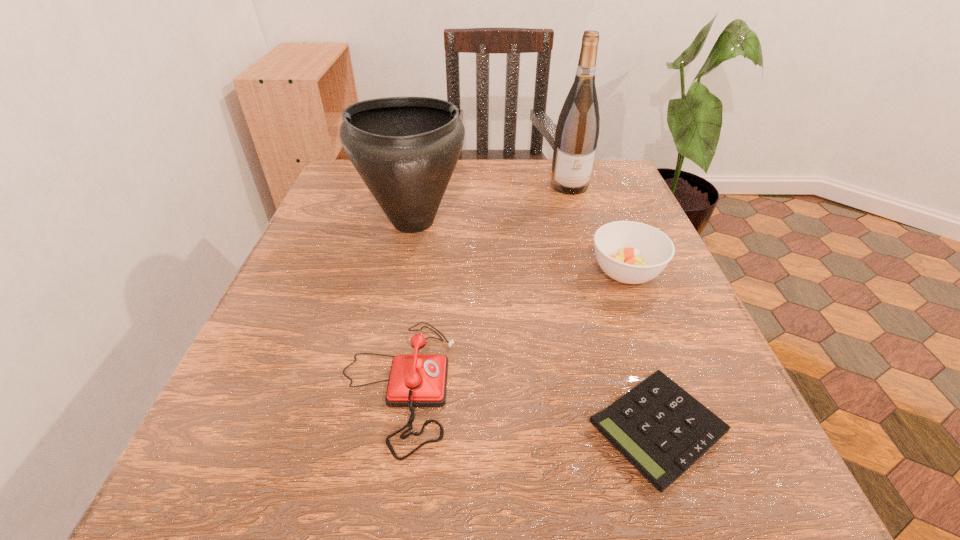
Locate an element on the screen. The height and width of the screenshot is (540, 960). wine bottle located at the far edge is located at coordinates (577, 131).

Locate an element on the screen. This screenshot has height=540, width=960. urn that is at the far edge is located at coordinates (405, 149).

Find the location of a particular element. The width and height of the screenshot is (960, 540). telephone located in the near edge section of the desktop is located at coordinates pos(415,380).

At what (x,y) coordinates should I click in order to perform the action: click on calculator that is positioned at the near edge. Please return your answer as a coordinate pair (x, y). The image size is (960, 540). Looking at the image, I should click on click(x=662, y=430).

You are a GUI agent. You are given a task and a screenshot of the screen. Output one action in this format:
    pyautogui.click(x=<x>, y=<y>)
    Task: Click on the urn that is at the left edge
    Image resolution: width=960 pixels, height=540 pixels.
    Given the screenshot: What is the action you would take?
    pyautogui.click(x=405, y=149)

The width and height of the screenshot is (960, 540). In order to click on telephone that is at the left edge in this screenshot , I will do `click(415, 380)`.

At what (x,y) coordinates should I click in order to perform the action: click on wine bottle that is positioned at the right edge. Please return your answer as a coordinate pair (x, y). Image resolution: width=960 pixels, height=540 pixels. Looking at the image, I should click on (577, 131).

Where is `soup bowl that is at the right edge`? soup bowl that is at the right edge is located at coordinates (630, 252).

Identify the location of calculator at the right edge. This screenshot has width=960, height=540. (662, 430).

Find the location of `object located in the far left corner section of the desktop`. object located in the far left corner section of the desktop is located at coordinates (405, 149).